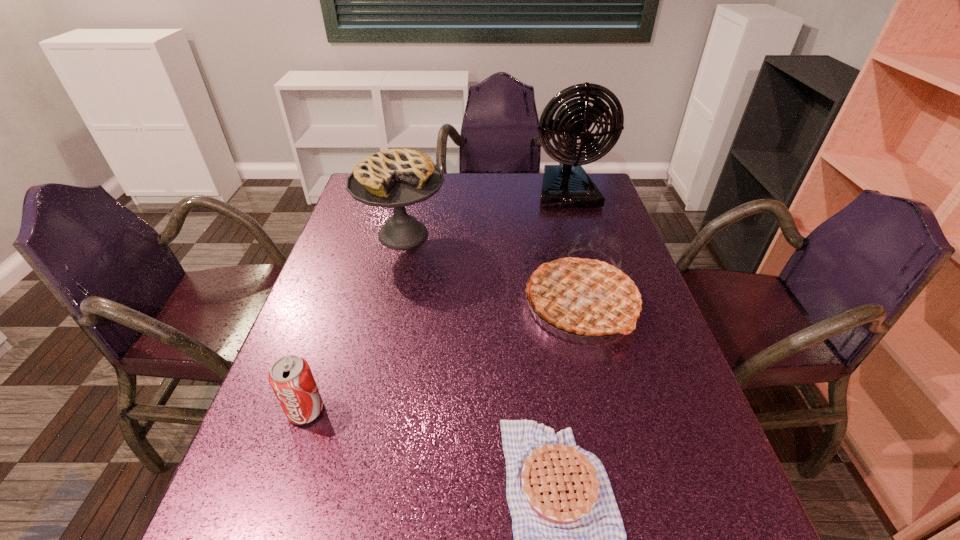
You are a GUI agent. You are given a task and a screenshot of the screen. Output one action in this format:
    pyautogui.click(x=<x>, y=<y>)
    Task: Click on the soda can located in the left edge section of the desktop
    
    Given the screenshot: What is the action you would take?
    pyautogui.click(x=290, y=377)

The width and height of the screenshot is (960, 540). Find the location of `fan located in the right edge section of the desktop`. fan located in the right edge section of the desktop is located at coordinates (568, 185).

Locate an element on the screen. The height and width of the screenshot is (540, 960). pie located at the right edge is located at coordinates 586,296.

This screenshot has height=540, width=960. Find the location of `object present at the far right corner`. object present at the far right corner is located at coordinates (568, 185).

At what (x,y) coordinates should I click in order to perform the action: click on free space at the far edge of the desktop. Please return your answer as a coordinate pair (x, y). Looking at the image, I should click on (504, 206).

Where is `free space at the left edge of the desktop`? The image size is (960, 540). free space at the left edge of the desktop is located at coordinates (329, 384).

I want to click on free spot at the right edge of the desktop, so click(688, 469).

Find the location of a particular element. This screenshot has height=540, width=960. vacant space at the near left corner of the desktop is located at coordinates (305, 537).

At what (x,y) coordinates should I click in order to perform the action: click on vacant point located between the second farthest pie and the second shortest object. Please return your answer as a coordinate pair (x, y). This screenshot has width=960, height=540. Looking at the image, I should click on (444, 358).

Locate an element on the screen. This screenshot has height=540, width=960. free space between the third farthest object and the leftmost pie is located at coordinates (x=492, y=270).